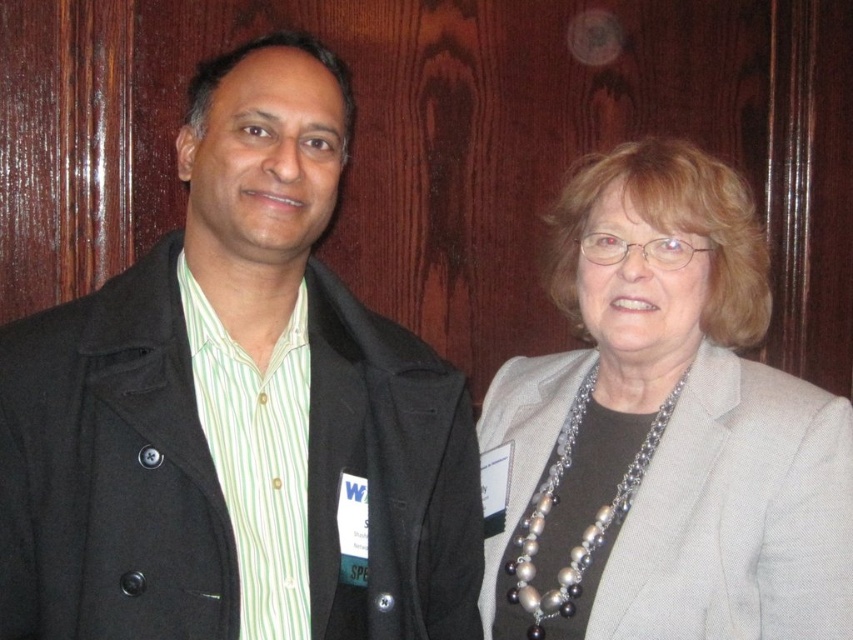
Question: Which of the following is the closest to the observer?

Choices:
 (A) gray fabric jacket at upper right
 (B) black wool coat at left

Answer: (B)

Question: Is black wool coat at left behind pearl and silver chain at center?

Choices:
 (A) yes
 (B) no

Answer: (B)

Question: Which object is farther from the camera taking this photo?

Choices:
 (A) pearl and silver chain at center
 (B) gray fabric jacket at upper right

Answer: (A)

Question: Can you confirm if gray fabric jacket at upper right is bigger than pearl and silver chain at center?

Choices:
 (A) no
 (B) yes

Answer: (B)

Question: Is black wool coat at left smaller than pearl and silver chain at center?

Choices:
 (A) no
 (B) yes

Answer: (A)

Question: Which object is farther from the camera taking this photo?

Choices:
 (A) gray fabric jacket at upper right
 (B) black wool coat at left
 (C) pearl and silver chain at center

Answer: (C)